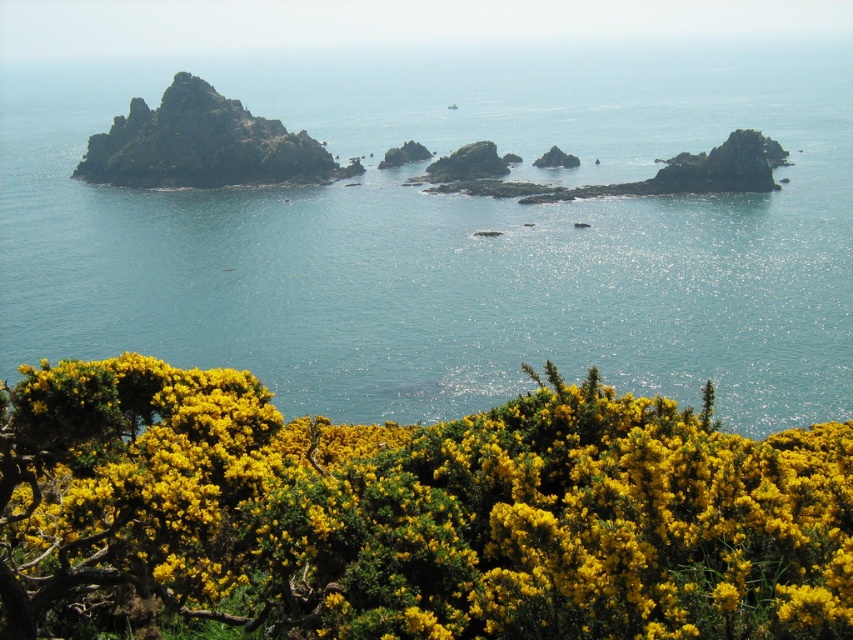
Question: Which object appears farthest from the camera in this image?

Choices:
 (A) rugged stone rock at left
 (B) clear blue water at center

Answer: (A)

Question: Which object is positioned farthest from the rugged stone rock at left?

Choices:
 (A) yellow textured bush at lower center
 (B) clear blue water at center

Answer: (A)

Question: Which point is closer to the camera?

Choices:
 (A) yellow textured bush at lower center
 (B) clear blue water at center

Answer: (A)

Question: Considering the relative positions of yellow textured bush at lower center and rugged stone rock at left in the image provided, where is yellow textured bush at lower center located with respect to rugged stone rock at left?

Choices:
 (A) below
 (B) above

Answer: (A)

Question: Where is clear blue water at center located in relation to rugged stone rock at left in the image?

Choices:
 (A) below
 (B) above

Answer: (B)

Question: Does clear blue water at center have a smaller size compared to rugged stone rock at left?

Choices:
 (A) no
 (B) yes

Answer: (A)